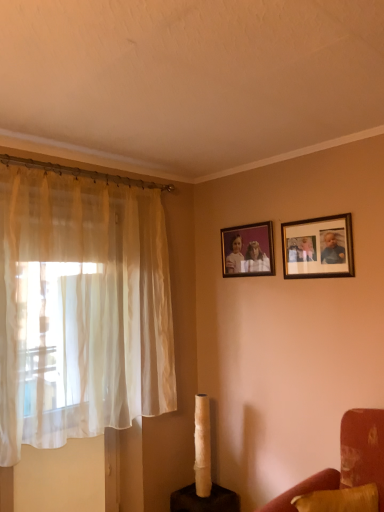
Question: From the image's perspective, is wooden photo frame at upper right, the second picture frame viewed from the back, above matte wooden picture frame at upper center, which is counted as the 1th picture frame, starting from the back?

Choices:
 (A) no
 (B) yes

Answer: (A)

Question: Is wooden photo frame at upper right, marked as the 1th picture frame in a front-to-back arrangement, to the left of matte wooden picture frame at upper center, placed as the 1th picture frame when sorted from left to right, from the viewer's perspective?

Choices:
 (A) no
 (B) yes

Answer: (A)

Question: Is wooden photo frame at upper right, marked as the 1th picture frame in a front-to-back arrangement, positioned with its back to matte wooden picture frame at upper center, which is counted as the 1th picture frame, starting from the back?

Choices:
 (A) yes
 (B) no

Answer: (B)

Question: Can you see wooden photo frame at upper right, marked as the 1th picture frame in a front-to-back arrangement, touching matte wooden picture frame at upper center, which is counted as the 1th picture frame, starting from the back?

Choices:
 (A) no
 (B) yes

Answer: (A)

Question: Is wooden photo frame at upper right, marked as the 1th picture frame in a front-to-back arrangement, not within matte wooden picture frame at upper center, placed as the 1th picture frame when sorted from left to right?

Choices:
 (A) yes
 (B) no

Answer: (A)

Question: From the image's perspective, is wooden photo frame at upper right, marked as the 1th picture frame in a front-to-back arrangement, under matte wooden picture frame at upper center, placed as the 1th picture frame when sorted from left to right?

Choices:
 (A) yes
 (B) no

Answer: (A)

Question: Is sheer white curtain at left aimed at wooden photo frame at upper right, the second picture frame viewed from the back?

Choices:
 (A) yes
 (B) no

Answer: (B)

Question: Does sheer white curtain at left appear on the left side of wooden photo frame at upper right, the second picture frame when ordered from left to right?

Choices:
 (A) yes
 (B) no

Answer: (A)

Question: Considering the relative sizes of sheer white curtain at left and wooden photo frame at upper right, the second picture frame viewed from the back, in the image provided, is sheer white curtain at left taller than wooden photo frame at upper right, the second picture frame viewed from the back,?

Choices:
 (A) yes
 (B) no

Answer: (A)

Question: Can you confirm if sheer white curtain at left is positioned to the right of wooden photo frame at upper right, the second picture frame viewed from the back?

Choices:
 (A) no
 (B) yes

Answer: (A)

Question: Is sheer white curtain at left shorter than wooden photo frame at upper right, which appears as the 1th picture frame when viewed from the right?

Choices:
 (A) no
 (B) yes

Answer: (A)

Question: Does sheer white curtain at left have a greater width compared to wooden photo frame at upper right, which appears as the 1th picture frame when viewed from the right?

Choices:
 (A) yes
 (B) no

Answer: (A)

Question: Would you say velvet red couch at lower right is outside sheer white curtain at left?

Choices:
 (A) yes
 (B) no

Answer: (A)